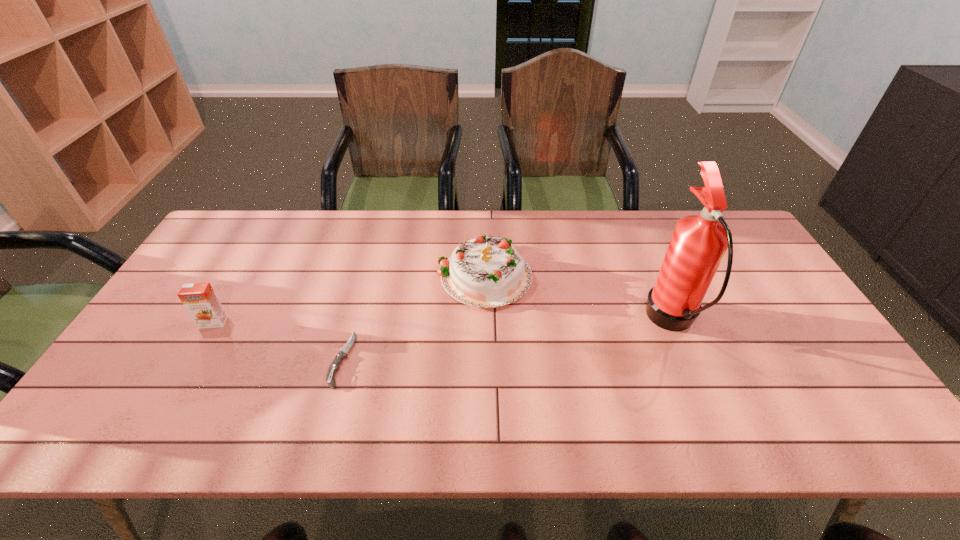
Identify the location of fire extinguisher. (699, 242).

Find the location of `the tallest object`. the tallest object is located at coordinates (699, 242).

At what (x,y) coordinates should I click in order to perform the action: click on the second tallest object. Please return your answer as a coordinate pair (x, y). This screenshot has width=960, height=540. Looking at the image, I should click on tap(486, 272).

At what (x,y) coordinates should I click in order to perform the action: click on the third object from left to right. Please return your answer as a coordinate pair (x, y). This screenshot has width=960, height=540. Looking at the image, I should click on (486, 272).

Image resolution: width=960 pixels, height=540 pixels. What are the coordinates of `orange juice` in the screenshot? It's located at (x=199, y=299).

Identify the location of the third tallest object. This screenshot has width=960, height=540. (199, 299).

You are a GUI agent. You are given a task and a screenshot of the screen. Output one action in this format:
    pyautogui.click(x=<x>, y=<y>)
    Task: Click on the shortest object
    The width and height of the screenshot is (960, 540).
    Given the screenshot: What is the action you would take?
    pyautogui.click(x=334, y=367)

The width and height of the screenshot is (960, 540). Identify the location of the second object from left to right. (334, 367).

At what (x,y) coordinates should I click in order to perform the action: click on vacant space situated at the spray nozzle of the fire extinguisher. Please return your answer as a coordinate pair (x, y). Looking at the image, I should click on (582, 322).

Locate an element on the screen. The image size is (960, 540). free space located 0.310m at the spray nozzle of the fire extinguisher is located at coordinates (535, 322).